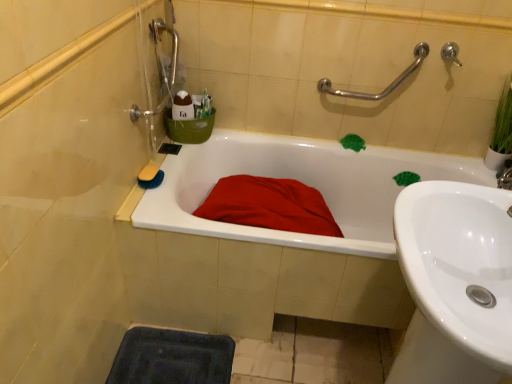
Question: In the image, is silver metallic faucet at upper right positioned in front of or behind dark blue rubber bath mat at lower left?

Choices:
 (A) front
 (B) behind

Answer: (B)

Question: Considering the positions of silver metallic faucet at upper right and dark blue rubber bath mat at lower left in the image, is silver metallic faucet at upper right wider or thinner than dark blue rubber bath mat at lower left?

Choices:
 (A) thin
 (B) wide

Answer: (A)

Question: Estimate the real-world distances between objects in this image. Which object is farther from the silver metallic faucet at upper right?

Choices:
 (A) yellow sponge at upper left
 (B) white glossy bathtub at center
 (C) silver metallic grab bar at upper right
 (D) white glossy sink at lower right
 (E) matte red blanket at center

Answer: (A)

Question: Which is farther from the silver metallic grab bar at upper right?

Choices:
 (A) silver metallic faucet at upper right
 (B) white glossy bathtub at center
 (C) white glossy sink at lower right
 (D) matte red blanket at center
 (E) dark blue rubber bath mat at lower left

Answer: (E)